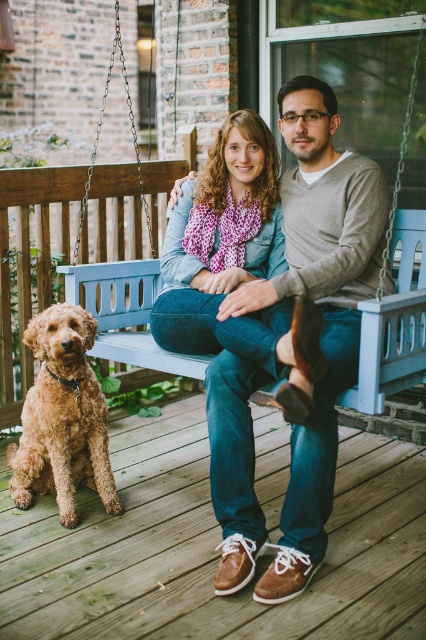
Can you confirm if matte brown shoes at center is positioned above denim scarf at center?

No, matte brown shoes at center is not above denim scarf at center.

Who is lower down, matte brown shoes at center or denim scarf at center?

matte brown shoes at center

Where is `matte brown shoes at center`? matte brown shoes at center is located at coordinates (319, 308).

Which is below, blue wooden swing at center or golden curly fur dog at lower left?

Positioned lower is golden curly fur dog at lower left.

Who is shorter, blue wooden swing at center or golden curly fur dog at lower left?

golden curly fur dog at lower left is shorter.

The image size is (426, 640). Describe the element at coordinates (370, 157) in the screenshot. I see `blue wooden swing at center` at that location.

The height and width of the screenshot is (640, 426). What are the coordinates of `blue wooden swing at center` in the screenshot? It's located at (370, 157).

Does matte brown shoes at center have a lesser width compared to golden curly fur dog at lower left?

No.

Between matte brown shoes at center and golden curly fur dog at lower left, which one has more height?

Standing taller between the two is matte brown shoes at center.

Which is behind, point (236, 417) or point (69, 404)?

Point (69, 404)

Where is `matte brown shoes at center`? matte brown shoes at center is located at coordinates (319, 308).